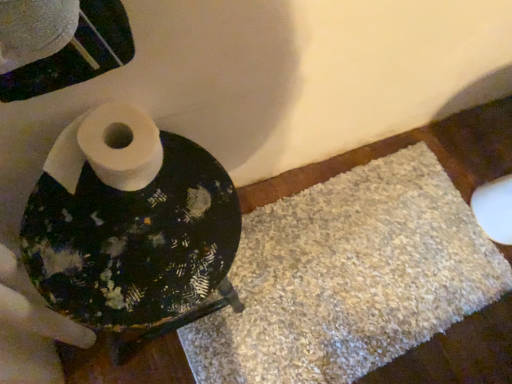
The width and height of the screenshot is (512, 384). I want to click on vacant space in front of white matte toilet paper at center, so click(101, 256).